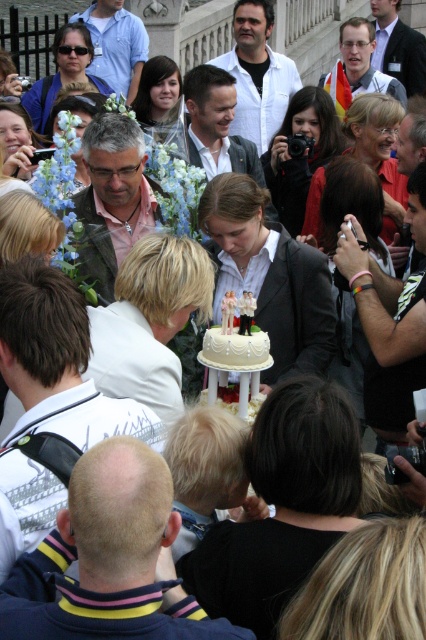
Question: Which of the following is the closest to the observer?

Choices:
 (A) white shirt at center
 (B) light blue shirt at upper center

Answer: (A)

Question: Which point is closer to the camera?

Choices:
 (A) (106, 26)
 (B) (77, 531)

Answer: (B)

Question: Which of the following is the closest to the observer?

Choices:
 (A) (356, 38)
 (B) (106, 19)
 (C) (270, 13)
 (D) (199, 355)

Answer: (D)

Question: Does matte pink shirt at center appear under light blue shirt at upper center?

Choices:
 (A) yes
 (B) no

Answer: (A)

Question: Is white shirt at center to the right of smooth gray suit at center from the viewer's perspective?

Choices:
 (A) no
 (B) yes

Answer: (A)

Question: Is matte pink shirt at center below matte black jacket at upper center?

Choices:
 (A) no
 (B) yes

Answer: (B)